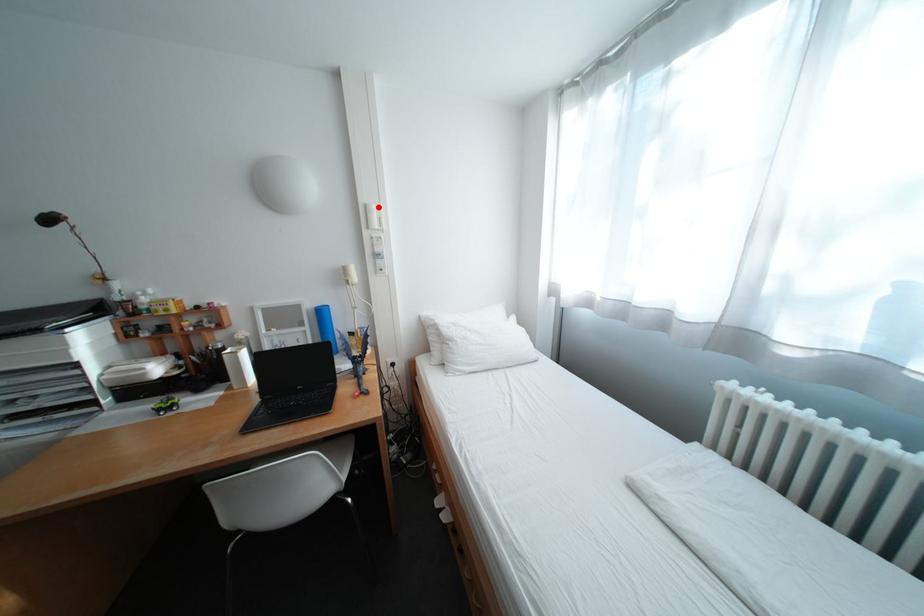
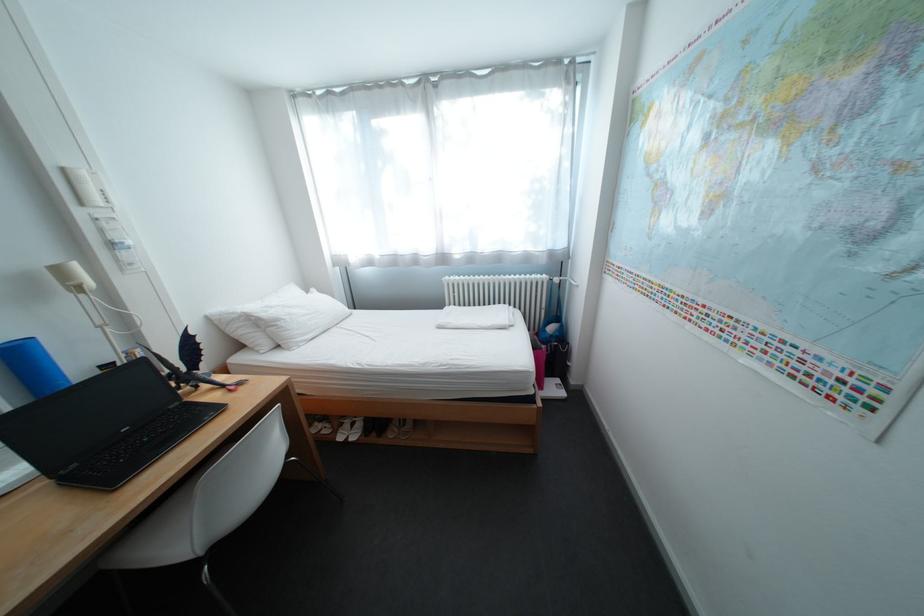
Find the pixel in the second image that matches the highlighted location in the first image.

(76, 171)